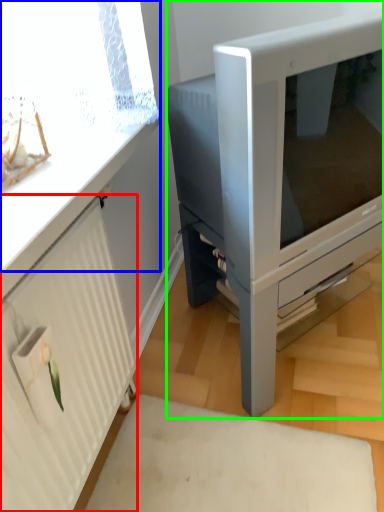
Question: Based on their relative distances, which object is farther from radiator (highlighted by a red box)? Choose from window screen (highlighted by a blue box) and furniture (highlighted by a green box).

Choices:
 (A) window screen
 (B) furniture

Answer: (B)